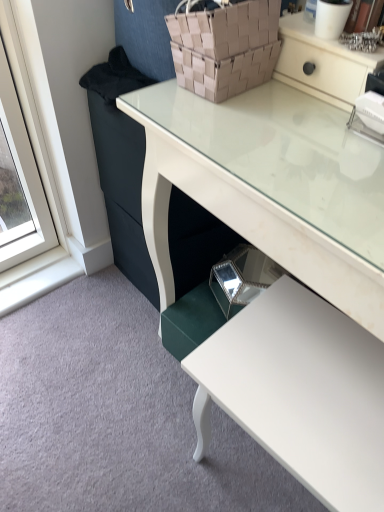
You are a GUI agent. You are given a task and a screenshot of the screen. Output one action in this format:
    pyautogui.click(x=<x>, y=<y>)
    Task: Click on the vacant space situated above white glossy table at lower right (from a real-world perspective)
    The width and height of the screenshot is (384, 512).
    Given the screenshot: What is the action you would take?
    click(308, 372)